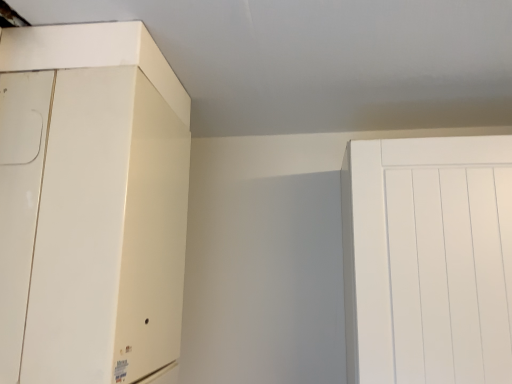
What do you see at coordinates (90, 204) in the screenshot? Image resolution: width=512 pixels, height=384 pixels. I see `matte white cabinet at upper left` at bounding box center [90, 204].

This screenshot has height=384, width=512. What are the coordinates of `matte white cabinet at upper left` in the screenshot? It's located at (90, 204).

Identify the location of matte white cabinet at upper left. (90, 204).